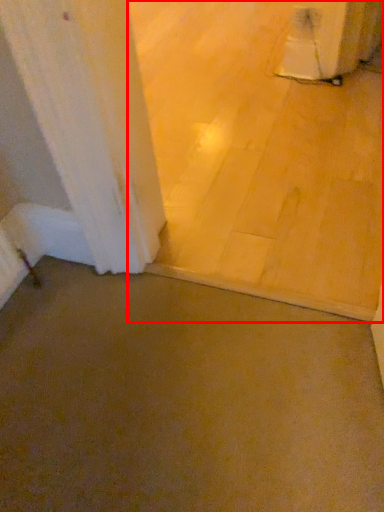
Question: From the image's perspective, what is the correct spatial relationship of concrete (annotated by the red box) in relation to concrete?

Choices:
 (A) below
 (B) above

Answer: (B)